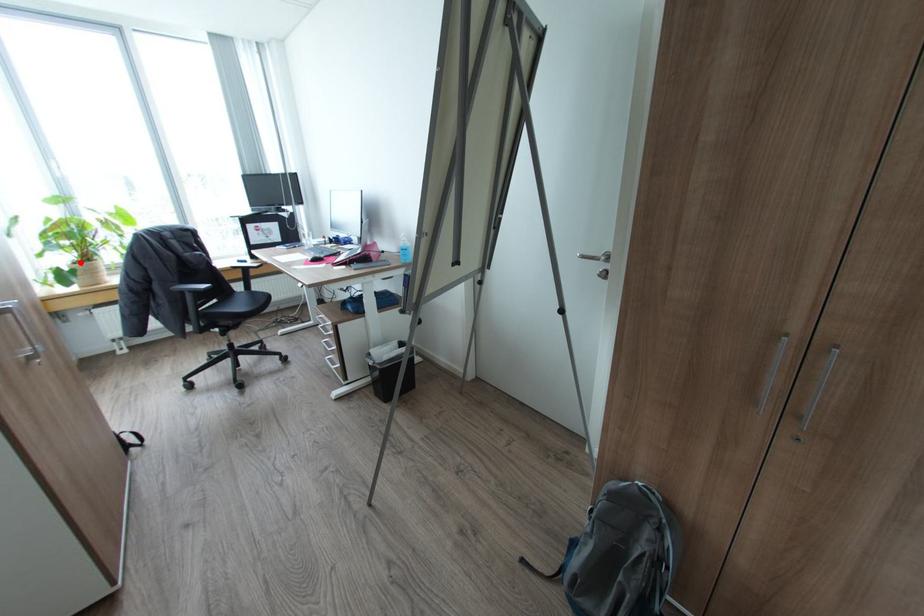
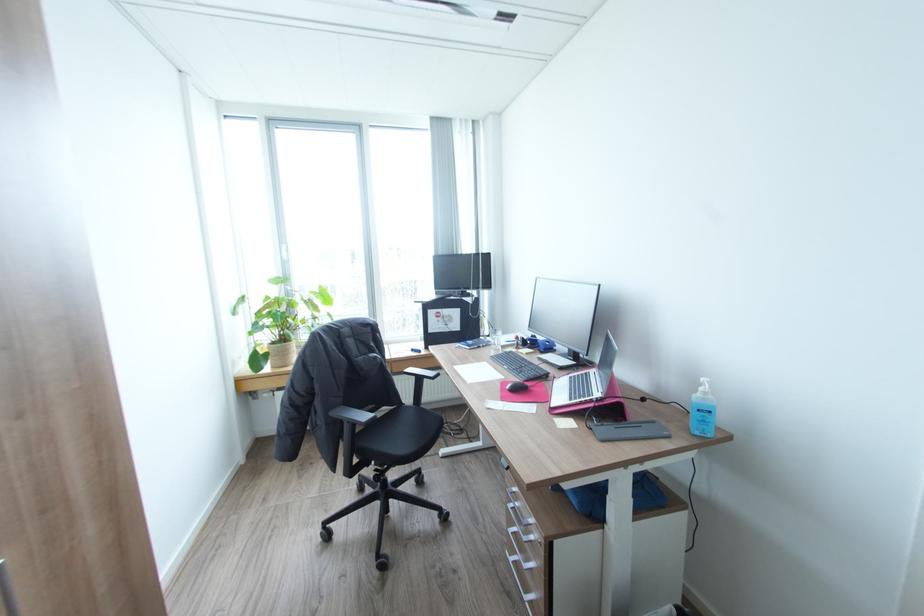
Find the pixel in the second image that matches the highlighted location in the first image.

(277, 342)